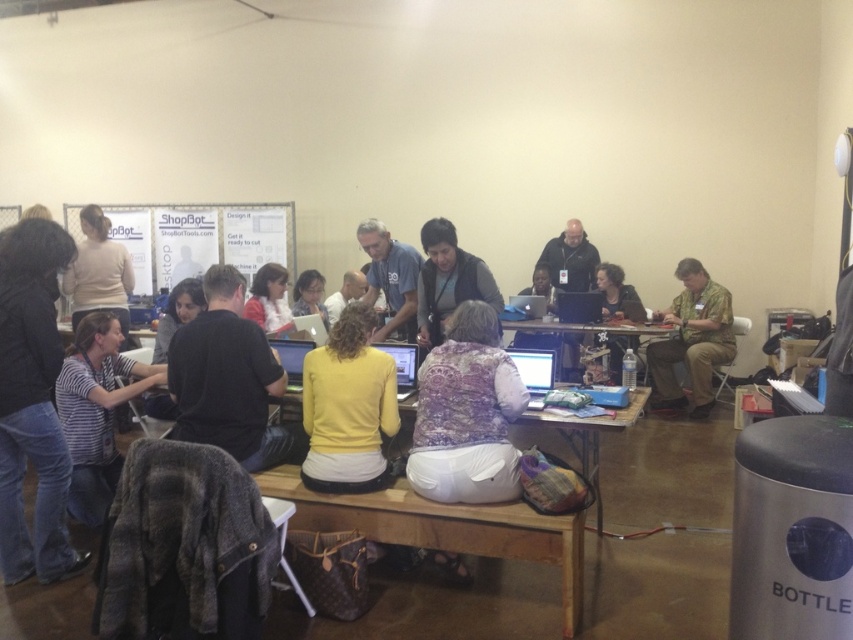
Which is behind, point (273, 438) or point (97, 442)?

The point (97, 442) is more distant.

Is black matte shirt at center closer to the viewer compared to striped fabric shirt at lower left?

Yes, it is in front of striped fabric shirt at lower left.

Identify the location of black matte shirt at center. (225, 378).

Where is `black matte shirt at center`? The width and height of the screenshot is (853, 640). black matte shirt at center is located at coordinates (225, 378).

Does hemp fabric shirt at center have a lesser width compared to matte black laptop at center?

In fact, hemp fabric shirt at center might be wider than matte black laptop at center.

Can you confirm if hemp fabric shirt at center is positioned to the left of matte black laptop at center?

No, hemp fabric shirt at center is not to the left of matte black laptop at center.

What do you see at coordinates (692, 340) in the screenshot? This screenshot has height=640, width=853. I see `hemp fabric shirt at center` at bounding box center [692, 340].

Locate an element on the screen. This screenshot has height=640, width=853. hemp fabric shirt at center is located at coordinates (692, 340).

Between point (193, 410) and point (619, 340), which one is positioned in front?

Point (193, 410) is more forward.

Does black matte shirt at center come in front of wooden table at center?

Yes, it is in front of wooden table at center.

Is point (223, 269) positioned in front of point (549, 328)?

Yes, point (223, 269) is closer to viewer.

Identify the location of black matte shirt at center. (225, 378).